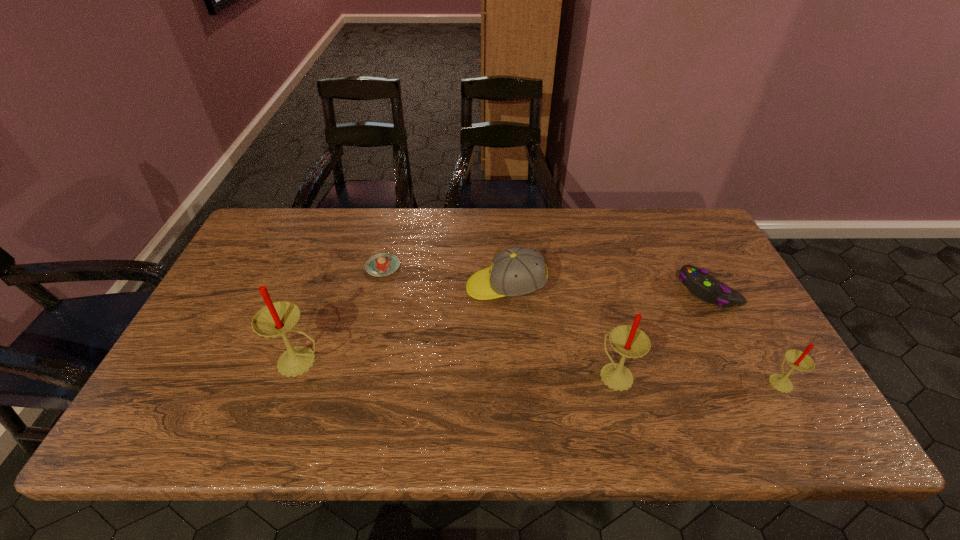
Image resolution: width=960 pixels, height=540 pixels. I want to click on the leftmost candle, so click(276, 319).

Where is `the second tallest candle`? the second tallest candle is located at coordinates (630, 342).

Find the location of `the fifth shortest object`. the fifth shortest object is located at coordinates (630, 342).

The height and width of the screenshot is (540, 960). In order to click on the shortest candle in this screenshot , I will do `click(798, 360)`.

The width and height of the screenshot is (960, 540). In order to click on control in this screenshot , I will do `click(698, 281)`.

Locate an element on the screen. The height and width of the screenshot is (540, 960). pastry is located at coordinates (383, 264).

I want to click on the shortest object, so click(383, 264).

The width and height of the screenshot is (960, 540). I want to click on the third shortest object, so click(517, 271).

Where is `baseball cap`? This screenshot has height=540, width=960. baseball cap is located at coordinates (517, 271).

You are a GUI agent. You are given a task and a screenshot of the screen. Output one action in this format:
    pyautogui.click(x=<x>, y=<y>)
    Task: Click on the vacant space located 0.210m on the back of the leftmost candle
    Image resolution: width=960 pixels, height=540 pixels.
    Given the screenshot: What is the action you would take?
    pyautogui.click(x=327, y=286)